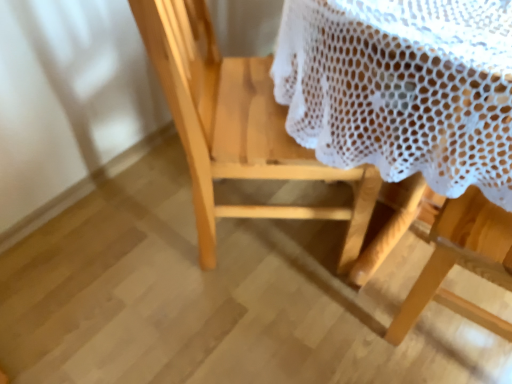
The image size is (512, 384). What do you see at coordinates (237, 126) in the screenshot? I see `natural wood chair at center` at bounding box center [237, 126].

Find the location of a particular element. The image size is (512, 384). natural wood chair at center is located at coordinates (237, 126).

The height and width of the screenshot is (384, 512). Find the location of `natural wood chair at center`. natural wood chair at center is located at coordinates (237, 126).